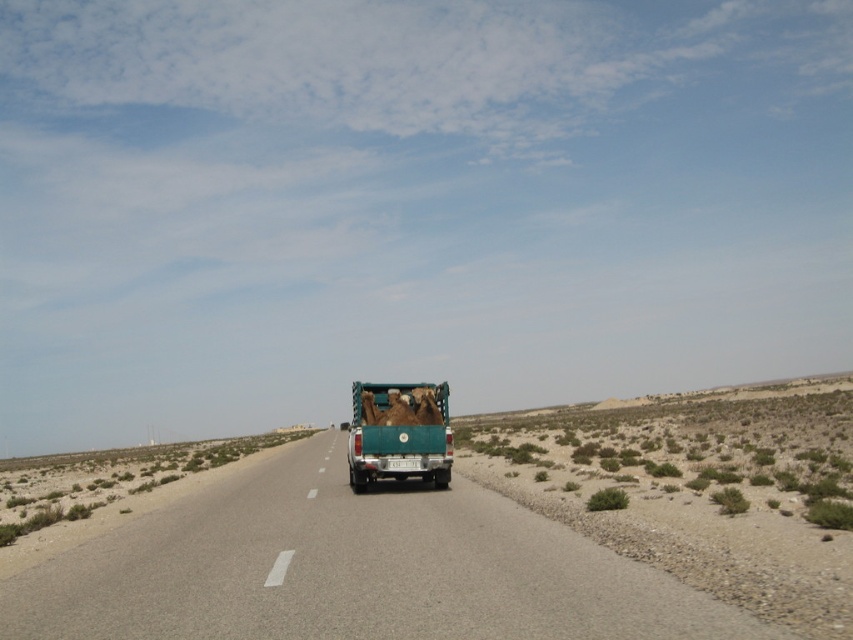
You are a delivery driver navigating a rural road in a desert area. Your GPS shows a point at coordinates (351, 570). Based on the scene, where is this point located?

The point at coordinates (351, 570) is located on the asphalt road at center, so the point is on the road in the middle of the scene.

You are a photographer standing at the edge of the road, trying to capture the green pickup truck with camels in the bed. You notice two points marked on your camera screen at coordinates point (x=311, y=458) and point (x=374, y=394). Which point is closer to your camera?

Point (x=311, y=458) is closer to the camera than point (x=374, y=394) because it is further to the camera than the other point.